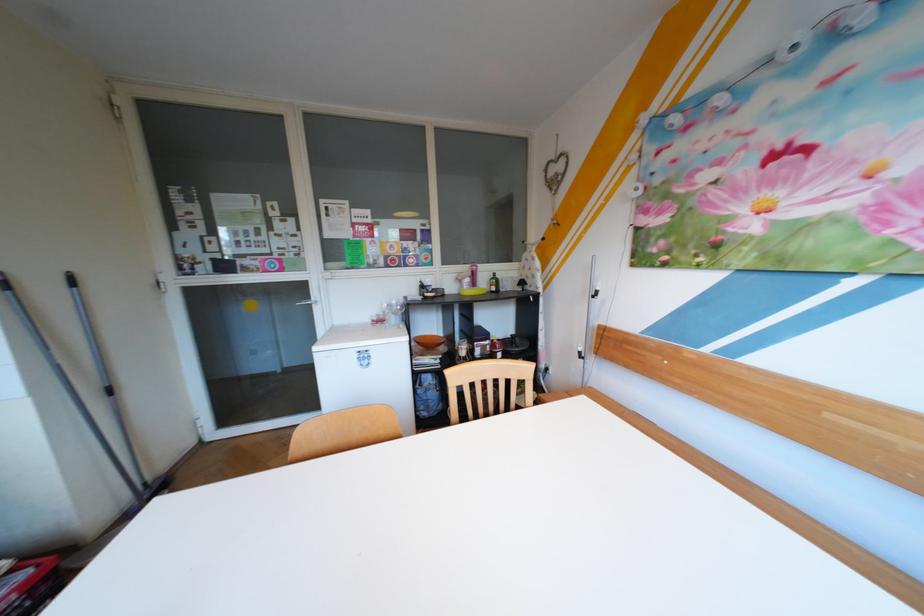
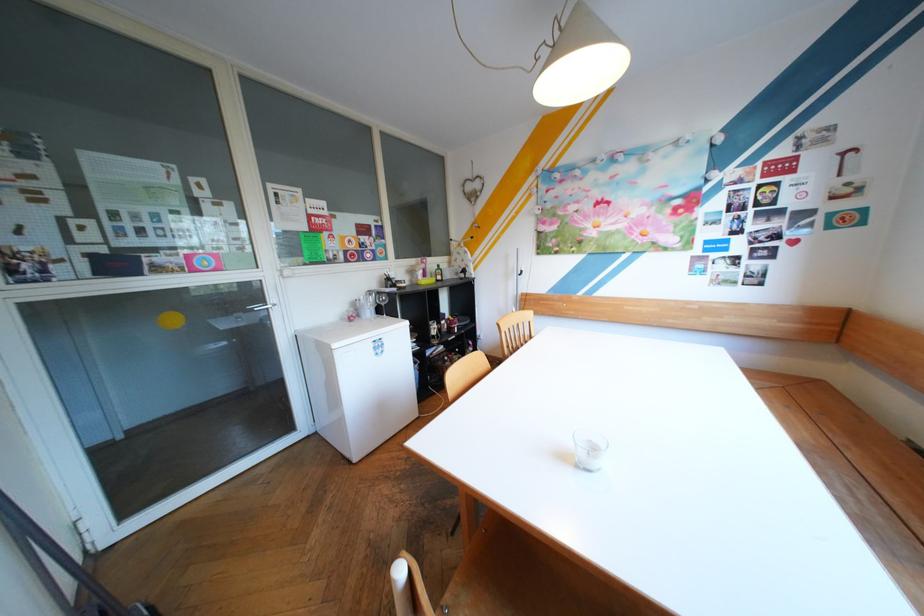
In the second image, find the point that corresponds to point (481, 280) in the first image.

(434, 270)